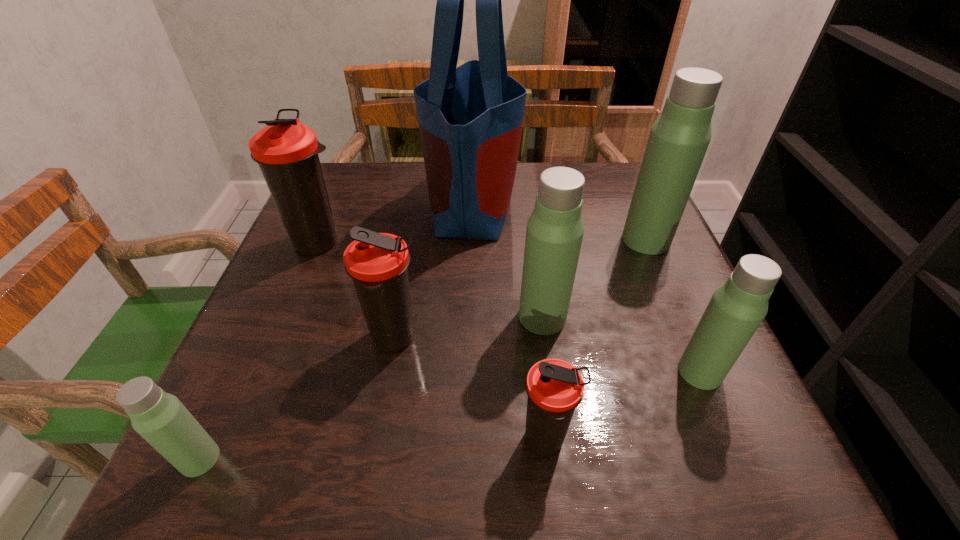
I want to click on the second smallest light thermos bottle, so click(x=736, y=309).

The height and width of the screenshot is (540, 960). In order to click on the nearest brown thermos bottle in this screenshot , I will do `click(555, 388)`.

Find the location of a particular element. The height and width of the screenshot is (540, 960). the smallest brown thermos bottle is located at coordinates (555, 388).

Locate an element on the screen. Image resolution: width=960 pixels, height=540 pixels. the leftmost light thermos bottle is located at coordinates (160, 418).

Where is `the nearest light thermos bottle`? Image resolution: width=960 pixels, height=540 pixels. the nearest light thermos bottle is located at coordinates (160, 418).

Find the location of a particular element. The width and height of the screenshot is (960, 540). blank area located on the left of the handbag is located at coordinates (332, 202).

At what (x,y) coordinates should I click in order to perform the action: click on free space located 0.290m on the front of the seventh shortest object. Please return your answer as a coordinate pair (x, y). The width and height of the screenshot is (960, 540). Looking at the image, I should click on (701, 369).

You are a GUI agent. You are given a task and a screenshot of the screen. Output one action in this format:
    pyautogui.click(x=<x>, y=<y>)
    Task: Click on the free space located 0.200m on the front of the leftmost brown thermos bottle
    This screenshot has height=540, width=960.
    Given the screenshot: What is the action you would take?
    pyautogui.click(x=281, y=336)

Find the location of `free spot located on the right of the second light thermos bottle from left to right`. free spot located on the right of the second light thermos bottle from left to right is located at coordinates (662, 317).

Where is `vacant space located 0.390m on the right of the second smallest brown thermos bottle`? This screenshot has height=540, width=960. vacant space located 0.390m on the right of the second smallest brown thermos bottle is located at coordinates (642, 339).